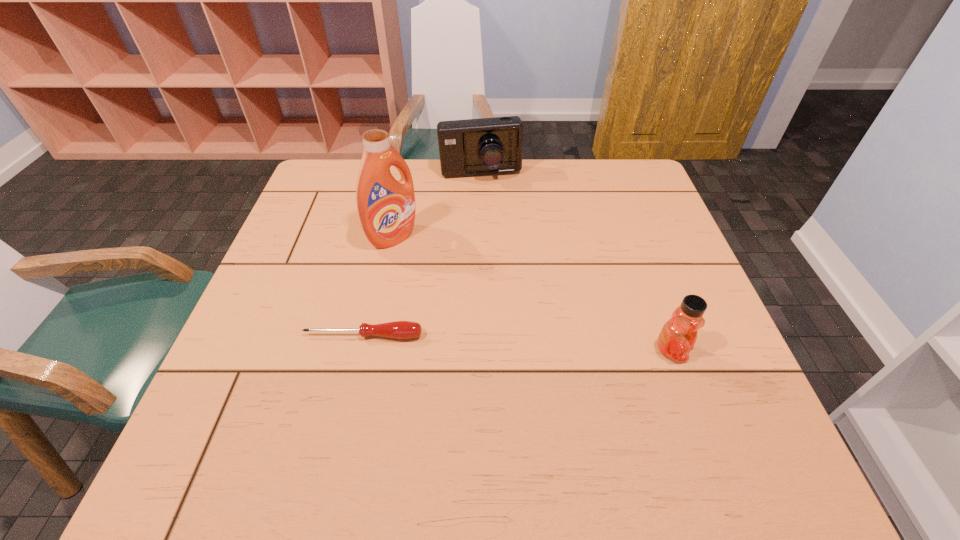
Where is `vacant point located 0.400m on the front-facing side of the farthest object`? The width and height of the screenshot is (960, 540). vacant point located 0.400m on the front-facing side of the farthest object is located at coordinates (497, 280).

Find the location of `vacant area situated 0.270m on the front-facing side of the farthest object`. vacant area situated 0.270m on the front-facing side of the farthest object is located at coordinates (492, 244).

The width and height of the screenshot is (960, 540). Identify the location of vacant space located on the front-facing side of the farthest object. (489, 222).

You are a GUI agent. You are given a task and a screenshot of the screen. Output one action in this format:
    pyautogui.click(x=<x>, y=<y>)
    Task: Click on the object that is at the far edge
    
    Given the screenshot: What is the action you would take?
    pyautogui.click(x=470, y=147)

At what (x,y) coordinates should I click in order to perform the action: click on object located in the left edge section of the desktop. Please return your answer as a coordinate pair (x, y). The height and width of the screenshot is (540, 960). Looking at the image, I should click on pos(399,329).

Locate an element on the screen. The width and height of the screenshot is (960, 540). object that is at the right edge is located at coordinates (678, 335).

In the image, there is a desktop. Where is `free space at the far edge`? This screenshot has height=540, width=960. free space at the far edge is located at coordinates (454, 183).

Identify the location of vacant space at the near edge of the desktop. The width and height of the screenshot is (960, 540). (422, 381).

Locate an element on the screen. free region at the left edge of the desktop is located at coordinates (332, 273).

Find the location of a particular element. The width and height of the screenshot is (960, 540). free location at the right edge of the desktop is located at coordinates (644, 255).